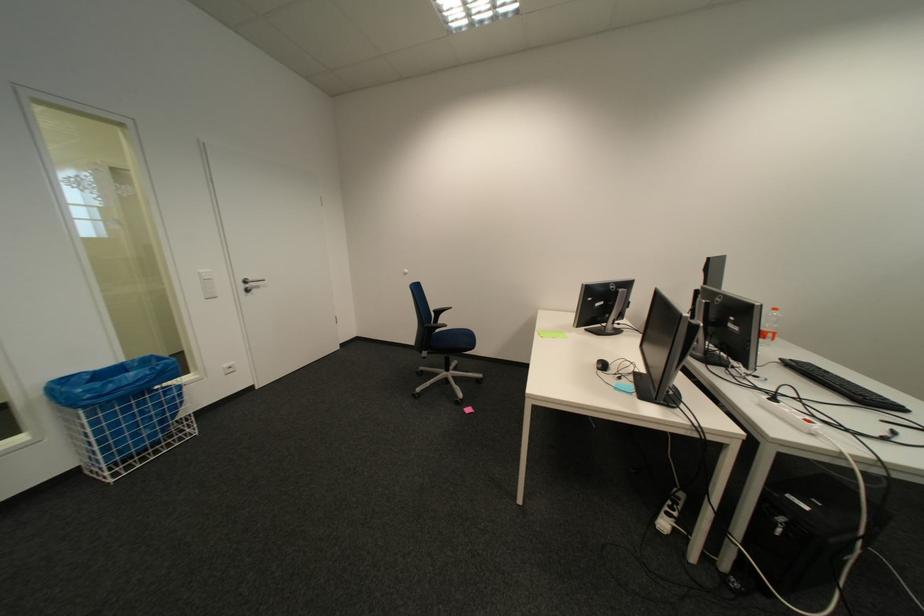
Where would you typ the black keyboard? Please return your answer as a coordinate pair (x, y).

(843, 386)